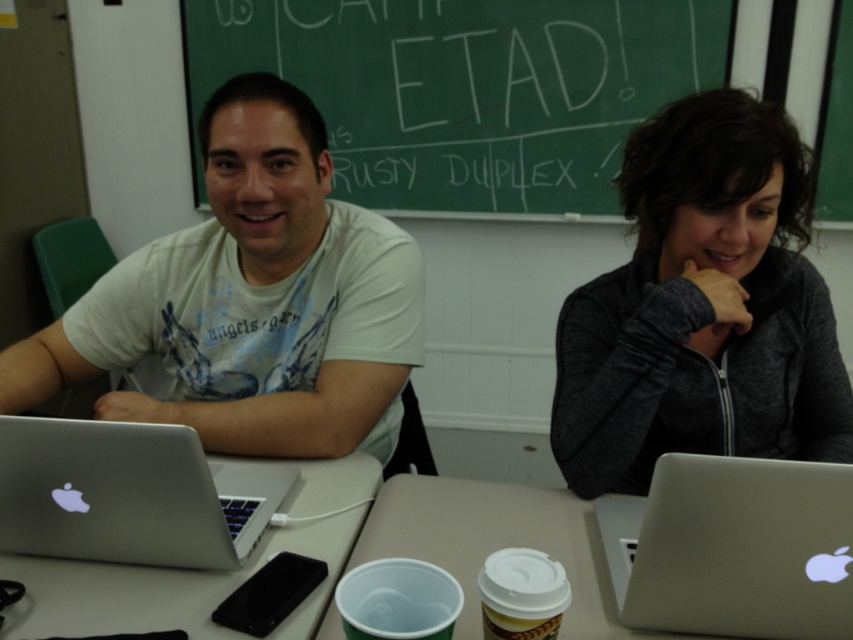
Who is positioned more to the left, sleek silver laptop at center or silver metallic laptop at left?

silver metallic laptop at left is more to the left.

Does sleek silver laptop at center lie behind silver metallic laptop at left?

No.

Find the location of a particular element. sleek silver laptop at center is located at coordinates (733, 548).

You are a GUI agent. You are given a task and a screenshot of the screen. Output one action in this format:
    pyautogui.click(x=<x>, y=<y>)
    Task: Click on the sleek silver laptop at center
    
    Given the screenshot: What is the action you would take?
    pyautogui.click(x=733, y=548)

Between point (102, 490) and point (561, 516), which one is positioned behind?

The point (561, 516) is behind.

Is silver metallic laptop at left taller than white plastic cup at center?

Yes, silver metallic laptop at left is taller than white plastic cup at center.

Which is behind, point (10, 525) or point (363, 532)?

The point (363, 532) is more distant.

Where is `silver metallic laptop at left`? The height and width of the screenshot is (640, 853). silver metallic laptop at left is located at coordinates (131, 493).

Is white matte shirt at center above silver metallic laptop at left?

Correct, white matte shirt at center is located above silver metallic laptop at left.

Can you confirm if white matte shirt at center is positioned below silver metallic laptop at left?

No, white matte shirt at center is not below silver metallic laptop at left.

The height and width of the screenshot is (640, 853). What are the coordinates of `white matte shirt at center` in the screenshot? It's located at (251, 300).